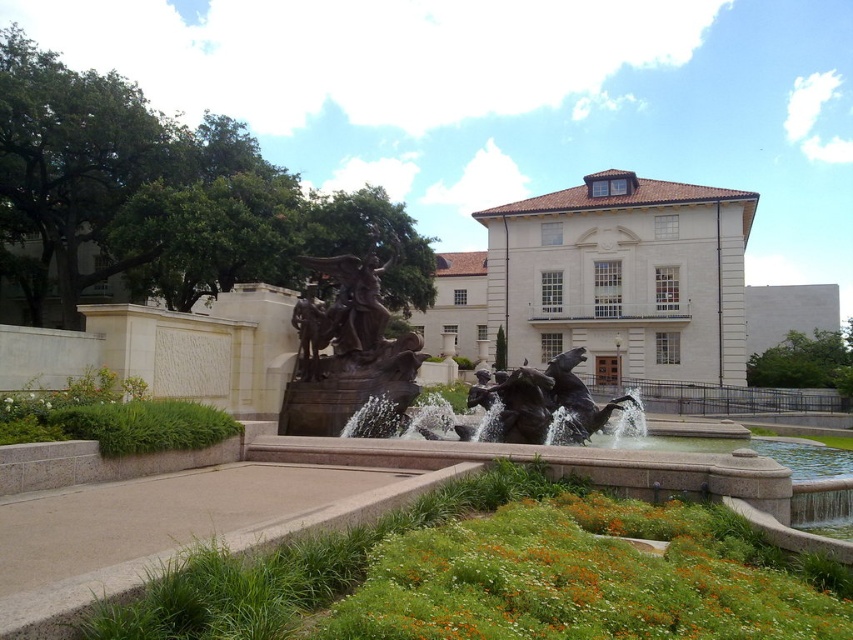
You are standing in the outdoor scene and want to reach the point marked at coordinates (534,474). Can you estimate how far this point is from your current position?

The point marked at coordinates (534,474) is 10.95 meters away from your current position.